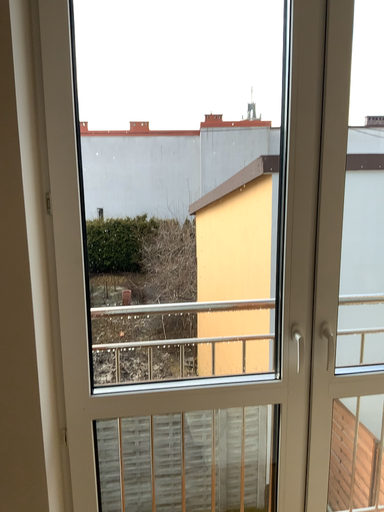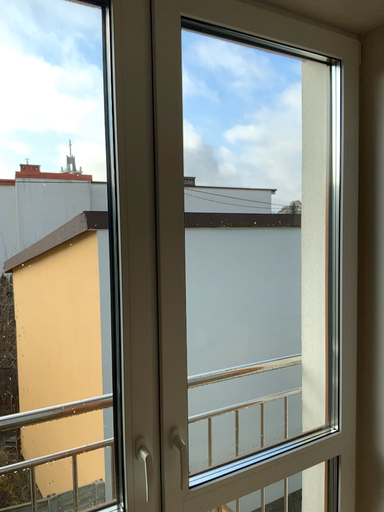
Question: Which way did the camera rotate in the video?

Choices:
 (A) rotated left
 (B) rotated right

Answer: (B)